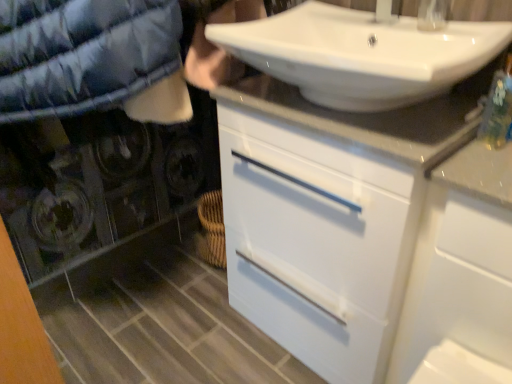
Where is `free area below white glossy sink at upper center (from a real-world perspective)`? Image resolution: width=512 pixels, height=384 pixels. free area below white glossy sink at upper center (from a real-world perspective) is located at coordinates (350, 111).